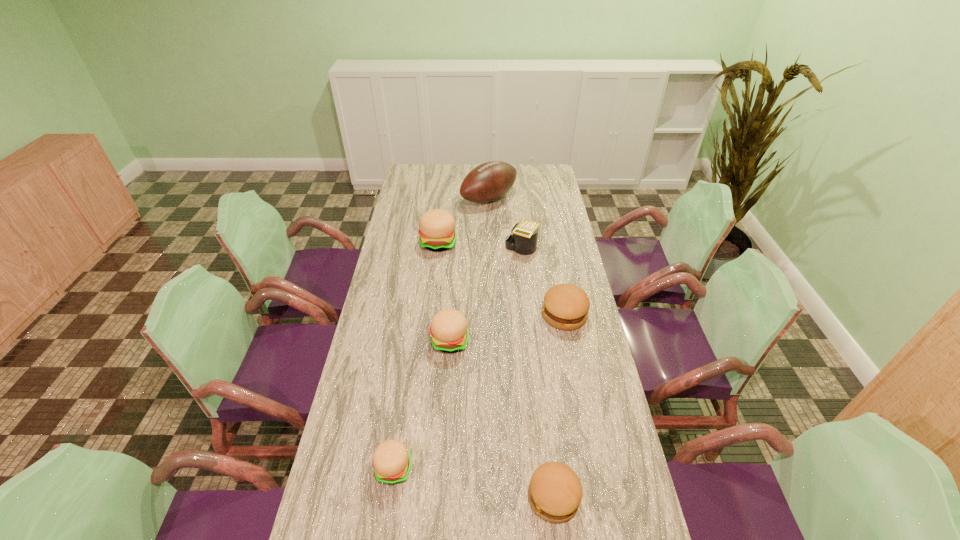
At what (x,y) coordinates should I click in order to perform the action: click on blank space located 0.340m on the front of the farthest hamburger. Please return your answer as a coordinate pair (x, y). Looking at the image, I should click on (430, 314).

Locate an element on the screen. The width and height of the screenshot is (960, 540). vacant space situated on the front of the second smallest beige hamburger is located at coordinates (443, 456).

Identify the location of vacant point located 0.330m on the back of the bigger brown hamburger. The width and height of the screenshot is (960, 540). (550, 245).

This screenshot has width=960, height=540. I want to click on free space located 0.360m on the back of the calculator, so click(x=516, y=194).

I want to click on free location located 0.070m on the back of the nearer brown hamburger, so click(547, 447).

Where is `free point located 0.370m on the right of the nearest beige hamburger`? This screenshot has height=540, width=960. free point located 0.370m on the right of the nearest beige hamburger is located at coordinates (551, 469).

Find the location of a particular element. This screenshot has width=960, height=540. object situated at the far edge is located at coordinates (489, 181).

Where is `calculator located in the right edge section of the desktop`? calculator located in the right edge section of the desktop is located at coordinates (523, 241).

The image size is (960, 540). In the image, there is a desktop. Find the location of `free space at the far edge`. free space at the far edge is located at coordinates (463, 165).

Locate an element on the screen. Image resolution: width=960 pixels, height=540 pixels. free location at the left edge of the desktop is located at coordinates (366, 323).